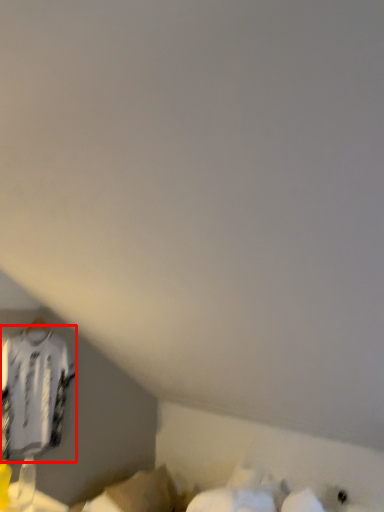
Question: Where is clothing (annotated by the red box) located in relation to wide in the image?

Choices:
 (A) left
 (B) right

Answer: (A)